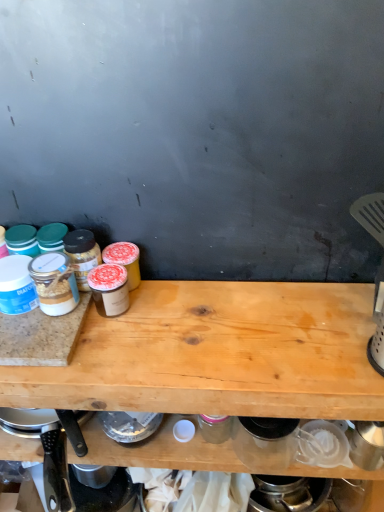
Question: Is light brown wood at center oriented away from granite cutting board at left?

Choices:
 (A) no
 (B) yes

Answer: (A)

Question: Considering the relative sizes of light brown wood at center and granite cutting board at left in the image provided, is light brown wood at center taller than granite cutting board at left?

Choices:
 (A) yes
 (B) no

Answer: (A)

Question: Is light brown wood at center directly adjacent to granite cutting board at left?

Choices:
 (A) yes
 (B) no

Answer: (B)

Question: Is light brown wood at center smaller than granite cutting board at left?

Choices:
 (A) no
 (B) yes

Answer: (A)

Question: Could you tell me if light brown wood at center is turned towards granite cutting board at left?

Choices:
 (A) no
 (B) yes

Answer: (A)

Question: Is granite cutting board at left to the left or to the right of black plastic knife at lower left in the image?

Choices:
 (A) left
 (B) right

Answer: (A)

Question: Is point (29, 351) closer or farther from the camera than point (49, 494)?

Choices:
 (A) closer
 (B) farther

Answer: (A)

Question: From a real-world perspective, is granite cutting board at left above or below black plastic knife at lower left?

Choices:
 (A) below
 (B) above

Answer: (B)

Question: Is granite cutting board at left taller or shorter than black plastic knife at lower left?

Choices:
 (A) short
 (B) tall

Answer: (A)

Question: In the image, is light brown wood at center positioned in front of or behind granite cutting board at left?

Choices:
 (A) front
 (B) behind

Answer: (A)

Question: Does point (317, 379) appear closer or farther from the camera than point (49, 346)?

Choices:
 (A) farther
 (B) closer

Answer: (B)

Question: From a real-world perspective, is light brown wood at center positioned above or below granite cutting board at left?

Choices:
 (A) above
 (B) below

Answer: (B)

Question: From the image's perspective, is light brown wood at center positioned above or below granite cutting board at left?

Choices:
 (A) above
 (B) below

Answer: (B)

Question: From the image's perspective, is granite cutting board at left located above or below light brown wood at center?

Choices:
 (A) below
 (B) above

Answer: (B)

Question: Looking at their shapes, would you say granite cutting board at left is wider or thinner than light brown wood at center?

Choices:
 (A) wide
 (B) thin

Answer: (B)